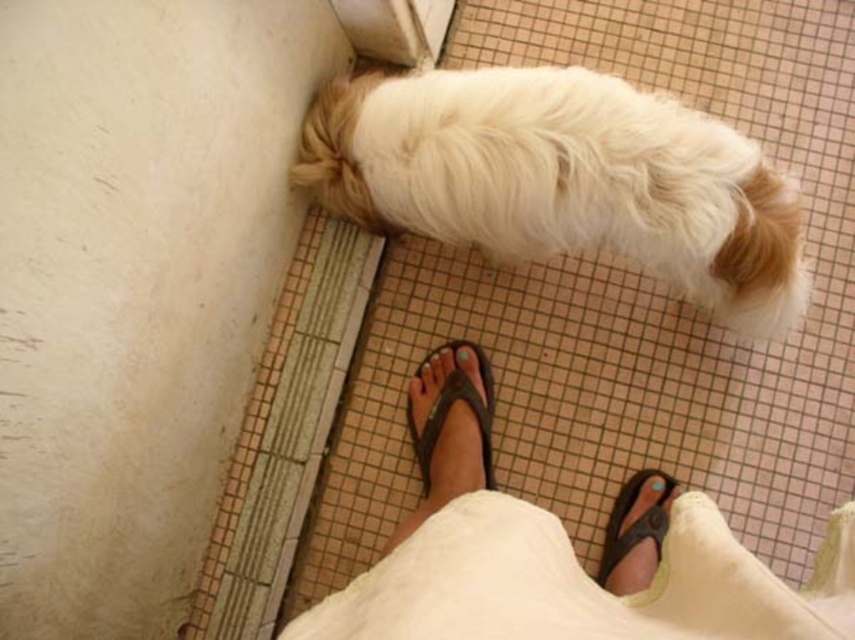
Between point (728, 252) and point (624, 497), which one is positioned behind?

The point (624, 497) is behind.

Looking at this image, is white fluffy dog at center below black rubber sandal at lower center?

Incorrect, white fluffy dog at center is not positioned below black rubber sandal at lower center.

The height and width of the screenshot is (640, 855). Identify the location of white fluffy dog at center. (562, 179).

Locate an element on the screen. white fluffy dog at center is located at coordinates (562, 179).

Between black rubber sandal at lower center and brown leather flip-flop at lower center, which one has more height?

brown leather flip-flop at lower center

Is point (629, 563) positioned behind point (447, 400)?

No.

Which is behind, point (628, 568) or point (482, 444)?

Point (482, 444)

You are a GUI agent. You are given a task and a screenshot of the screen. Output one action in this format:
    pyautogui.click(x=<x>, y=<y>)
    Task: Click on the black rubber sandal at lower center
    The width and height of the screenshot is (855, 640).
    Given the screenshot: What is the action you would take?
    pyautogui.click(x=635, y=531)

Can you confirm if white fluffy dog at center is shorter than brown leather flip-flop at lower center?

In fact, white fluffy dog at center may be taller than brown leather flip-flop at lower center.

From the picture: Who is lower down, white fluffy dog at center or brown leather flip-flop at lower center?

Positioned lower is brown leather flip-flop at lower center.

Describe the element at coordinates (562, 179) in the screenshot. I see `white fluffy dog at center` at that location.

Where is `white fluffy dog at center`? white fluffy dog at center is located at coordinates (562, 179).